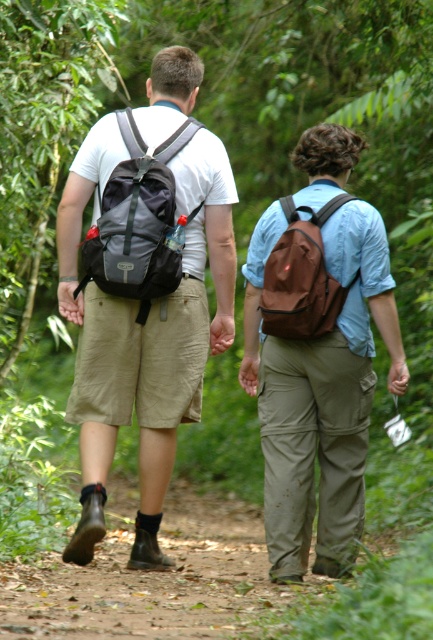
Does matte black backpack at center have a smaller size compared to matte black backpack at left?

Incorrect, matte black backpack at center is not smaller in size than matte black backpack at left.

Identify the location of matte black backpack at center. The height and width of the screenshot is (640, 433). (320, 365).

Identify the location of matte black backpack at center. (320, 365).

Can you confirm if brown matte backpack at center is positioned above brown fabric backpack at center?

Incorrect, brown matte backpack at center is not positioned above brown fabric backpack at center.

Can you confirm if brown matte backpack at center is thinner than brown fabric backpack at center?

No.

Is point (329, 273) positioned before point (333, 321)?

Yes, it is in front of point (333, 321).

The width and height of the screenshot is (433, 640). What are the coordinates of `brown matte backpack at center` in the screenshot? It's located at (316, 353).

Does matte black backpack at left lie behind matte gray backpack at center?

No, matte black backpack at left is in front of matte gray backpack at center.

Between point (158, 406) and point (148, 193), which one is positioned in front?

Point (148, 193)

Where is `matte black backpack at left`? The width and height of the screenshot is (433, 640). matte black backpack at left is located at coordinates (145, 289).